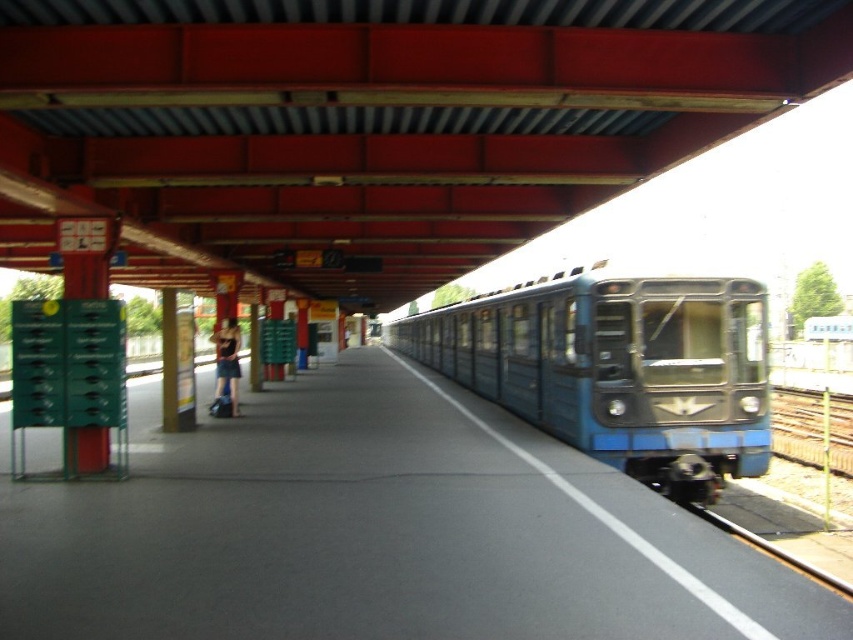
You are a passenger waiting for the train to depart. You are standing at the matte black dress at left location. The train doors are about to close. Can you make it to the blue metallic train at center before the doors close if you can run at 3 meters per second?

The distance between the blue metallic train at center and the matte black dress at left is 11.76 meters. At a running speed of 3 meters per second, it would take approximately 3.92 seconds to cover the distance. Since train doors typically close within 2 to 3 seconds, you would likely miss the train unless you can run faster than 3.92 meters per second.

Looking at this image, you are a passenger waiting for your train at the station. You see the blue metallic train at center and the matte black dress at left. Which object is closer to the edge marked by the white line on the platform?

The matte black dress at left is closer to the edge marked by the white line on the platform because the blue metallic train at center is positioned on the right side of it, meaning the dress is nearer to the edge.

You are standing on the platform and want to board the blue metallic train at center. The train doors are 1.2 meters wide. If you are 1.7 meters tall, will you be able to board the train comfortably?

The blue metallic train at center is 9.86 meters away from the viewer. Since the train doors are 1.2 meters wide, the distance between you and the train is sufficient to board comfortably as long as you are within the platform area. Your height of 1.7 meters is typical and should not hinder boarding.